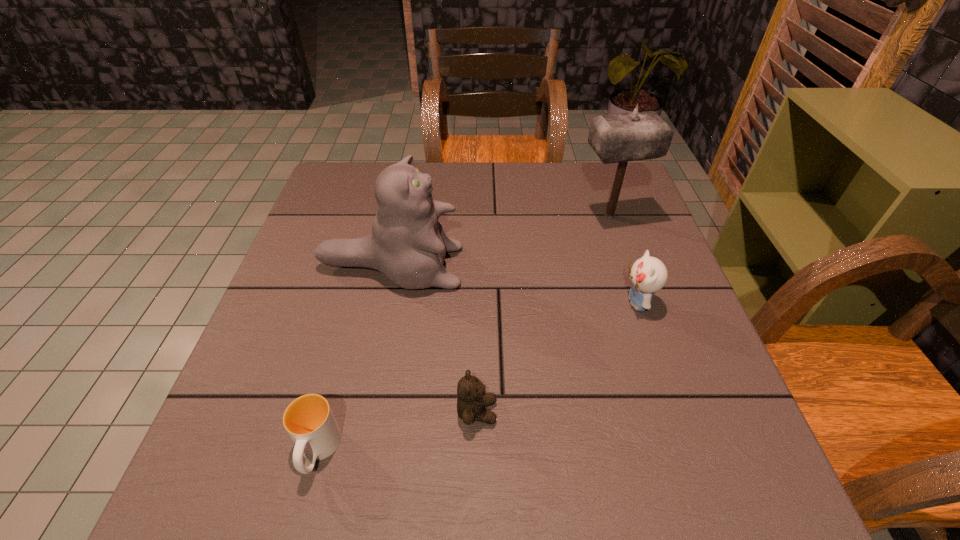
In order to click on vacant space that satisfies the following two spatial constraints: 1. on the front-facing side of the kitten; 2. with the handle on the side of the cup in this screenshot , I will do click(687, 451).